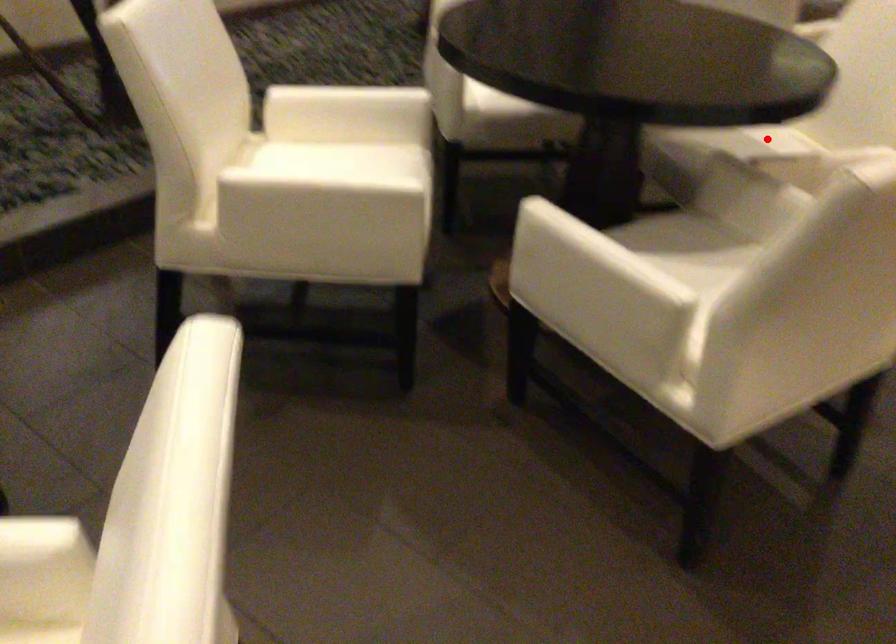
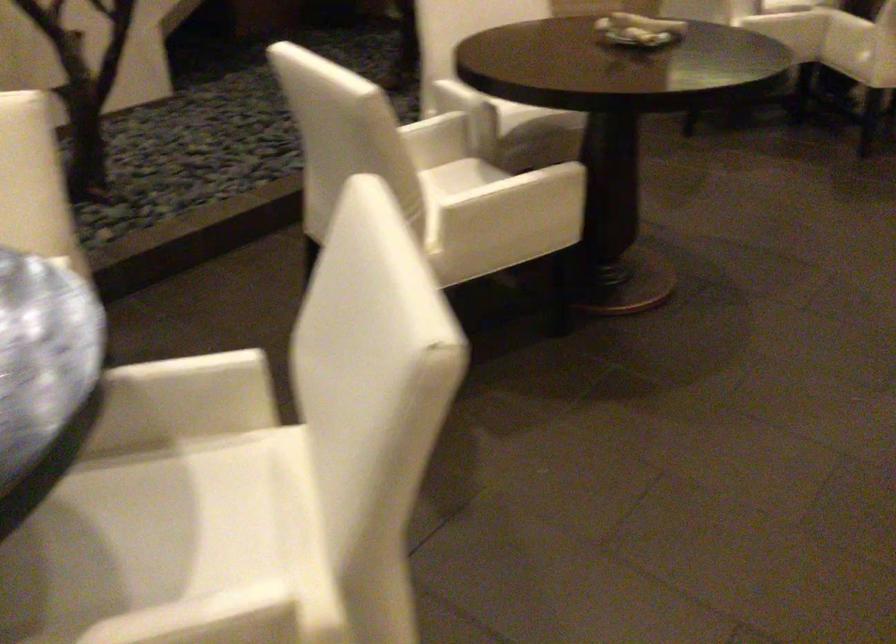
Question: I am providing you with two images of the same scene from different viewpoints. In image1, a red point is highlighted. Considering the same 3D point in image2, which of the following is correct?

Choices:
 (A) It is closer
 (B) It is farther

Answer: (A)